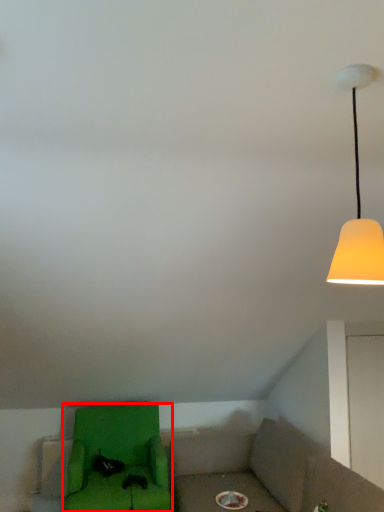
Question: Where is furniture (annotated by the red box) located in relation to lamp in the image?

Choices:
 (A) left
 (B) right

Answer: (A)